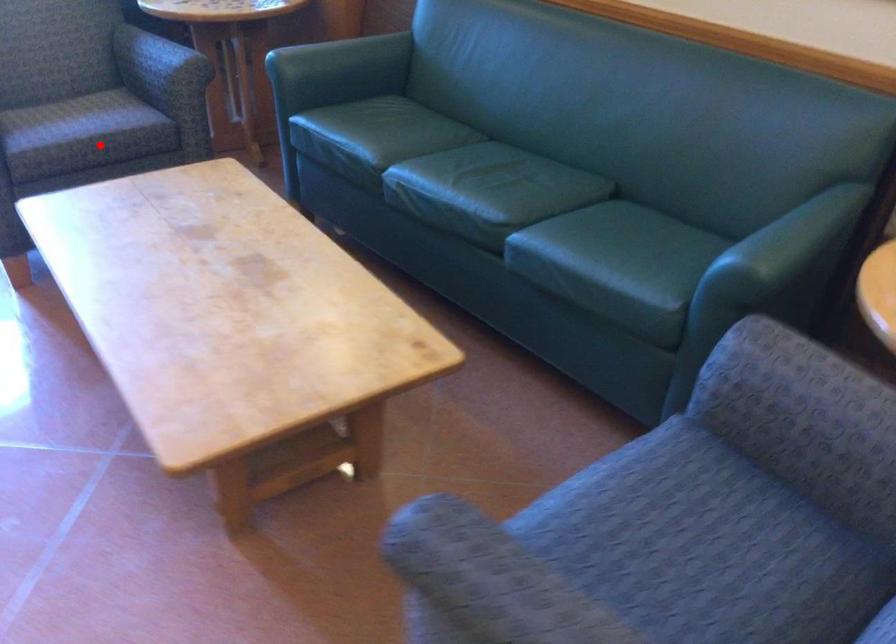
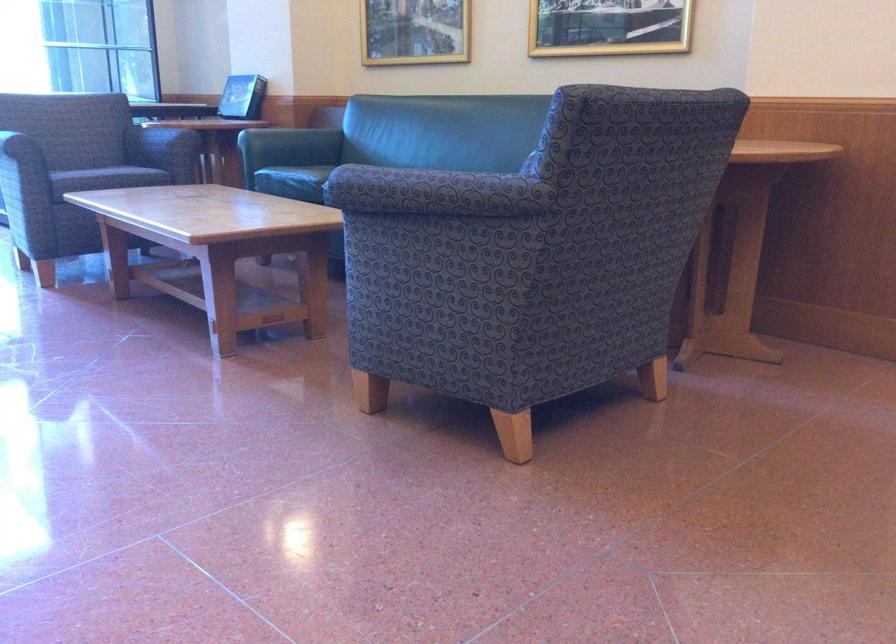
Find the pixel in the second image that matches the highlighted location in the first image.

(115, 176)